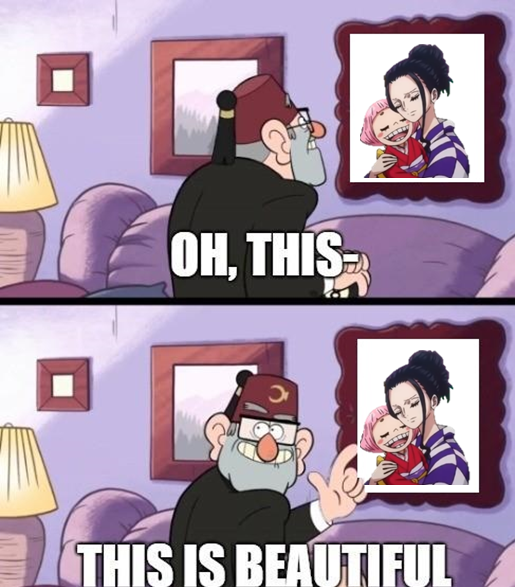
What are the coordinates of `yellow light shade` in the screenshot? It's located at (10, 465), (22, 180).